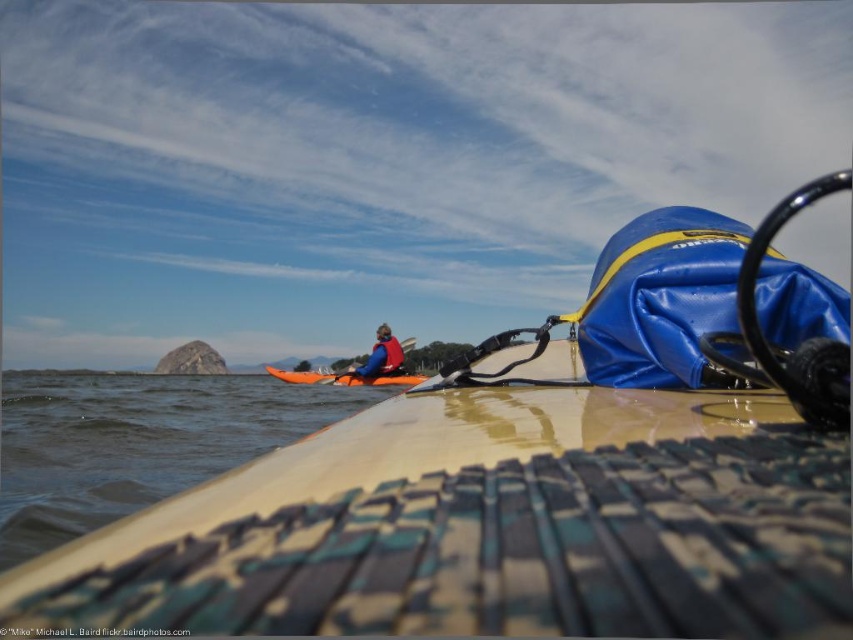
Who is more forward, (207,435) or (392,365)?

Point (207,435) is more forward.

Can you confirm if clear water at lower left is positioned below red life vest at center?

Indeed, clear water at lower left is positioned under red life vest at center.

Is point (223, 412) more distant than point (366, 374)?

No, it is in front of (366, 374).

Locate an element on the screen. clear water at lower left is located at coordinates (136, 442).

Is red life vest at center below orange plastic paddle at center?

No, red life vest at center is not below orange plastic paddle at center.

Between red life vest at center and orange plastic paddle at center, which one appears on the right side from the viewer's perspective?

red life vest at center is more to the right.

Does point (395, 355) come behind point (326, 372)?

No.

I want to click on red life vest at center, so coord(381,356).

Can you confirm if clear water at lower left is taller than orange plastic paddle at center?

Yes.

Which is in front, point (277, 404) or point (410, 348)?

Point (277, 404) is more forward.

Does point (258, 404) come closer to viewer compared to point (341, 372)?

Yes, point (258, 404) is closer to viewer.

What are the coordinates of `clear water at lower left` in the screenshot? It's located at coord(136,442).